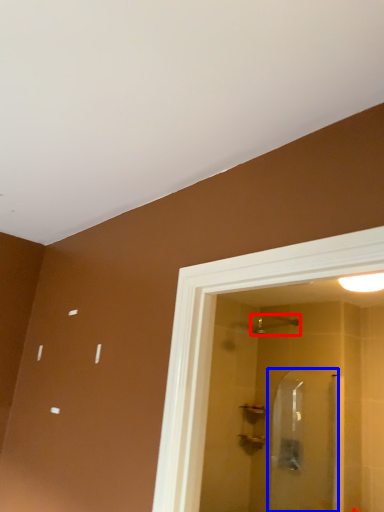
Question: Which object is further to the camera taking this photo, shower (highlighted by a red box) or screen door (highlighted by a blue box)?

Choices:
 (A) shower
 (B) screen door

Answer: (A)